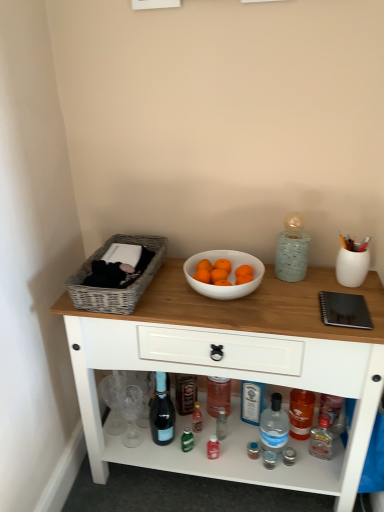
Find the location of a particular element. This screenshot has height=512, width=384. blank area to the left of white glossy bowl at center is located at coordinates (162, 289).